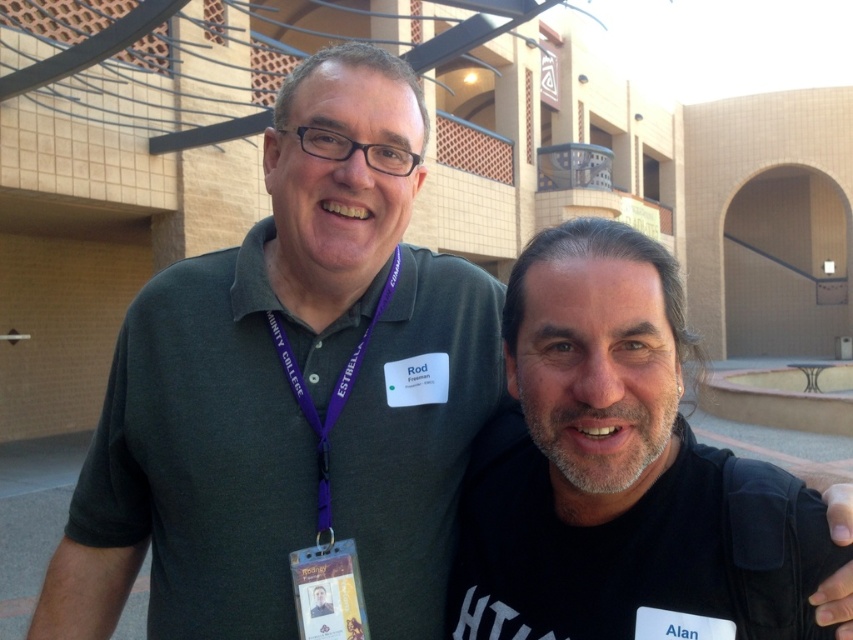
Question: Which is farther from the purple fabric lanyard at center?

Choices:
 (A) gray beard at center
 (B) matte green shirt at center

Answer: (A)

Question: Can you confirm if dark gray t-shirt at right is positioned to the left of purple fabric lanyard at center?

Choices:
 (A) no
 (B) yes

Answer: (A)

Question: From the image, what is the correct spatial relationship of dark gray t-shirt at right in relation to gray beard at center?

Choices:
 (A) above
 (B) below

Answer: (B)

Question: Is gray beard at center positioned at the back of purple fabric lanyard at center?

Choices:
 (A) no
 (B) yes

Answer: (A)

Question: Which object is closer to the camera taking this photo?

Choices:
 (A) dark gray t-shirt at right
 (B) gray beard at center
 (C) purple fabric lanyard at center
 (D) matte green shirt at center

Answer: (A)

Question: Which point is closer to the camera?

Choices:
 (A) matte green shirt at center
 (B) purple fabric lanyard at center
 (C) dark gray t-shirt at right

Answer: (C)